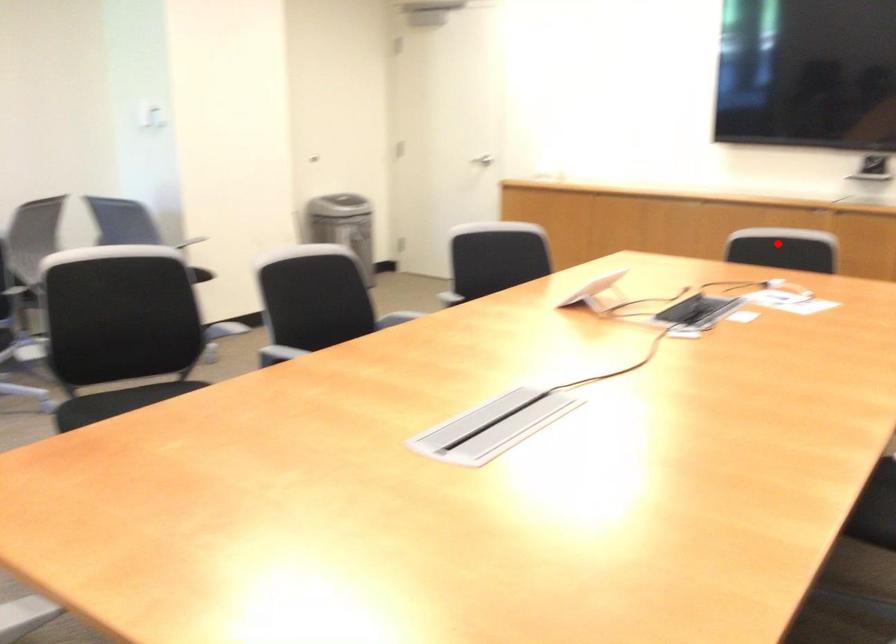
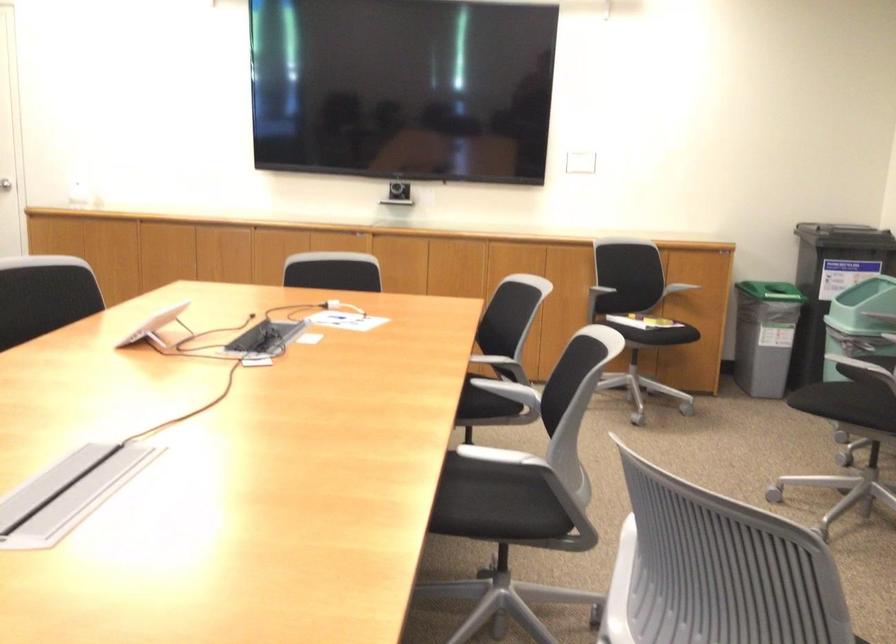
Find the pixel in the second image that matches the highlighted location in the first image.

(332, 272)